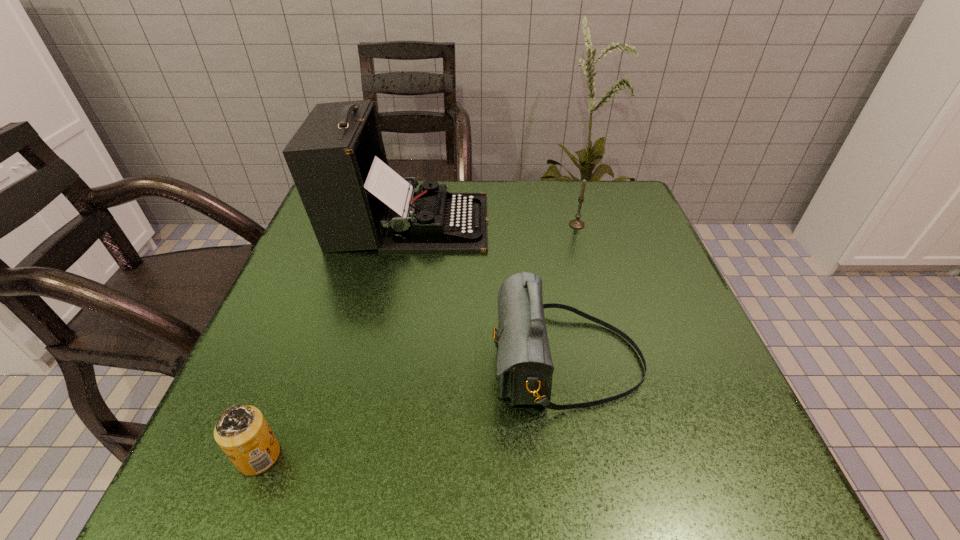
Where is `typewriter that is at the far edge`? This screenshot has width=960, height=540. typewriter that is at the far edge is located at coordinates tap(354, 201).

In order to click on candle that is at the far edge in this screenshot , I will do `click(575, 223)`.

I want to click on object that is at the near edge, so click(241, 431).

Where is `typewriter located in the left edge section of the desktop`? This screenshot has height=540, width=960. typewriter located in the left edge section of the desktop is located at coordinates (354, 201).

Where is `beer can positioned at the left edge`? This screenshot has height=540, width=960. beer can positioned at the left edge is located at coordinates (241, 431).

Locate an element on the screen. The image size is (960, 540). shoulder bag located at the right edge is located at coordinates (524, 363).

You are a GUI agent. You are given a task and a screenshot of the screen. Output one action in this format:
    pyautogui.click(x=<x>, y=<y>)
    Task: Click on the candle positioned at the right edge
    This screenshot has height=540, width=960.
    Given the screenshot: What is the action you would take?
    pyautogui.click(x=575, y=223)

You are a GUI agent. You are given a task and a screenshot of the screen. Output one action in this format:
    pyautogui.click(x=<x>, y=<y>)
    Task: Click on the object located at the far left corner
    The height and width of the screenshot is (540, 960).
    Given the screenshot: What is the action you would take?
    pyautogui.click(x=354, y=201)

Locate an element on the screen. The height and width of the screenshot is (540, 960). object that is at the near left corner is located at coordinates (241, 431).

Where is `object located at the far right corner`? The height and width of the screenshot is (540, 960). object located at the far right corner is located at coordinates (575, 223).